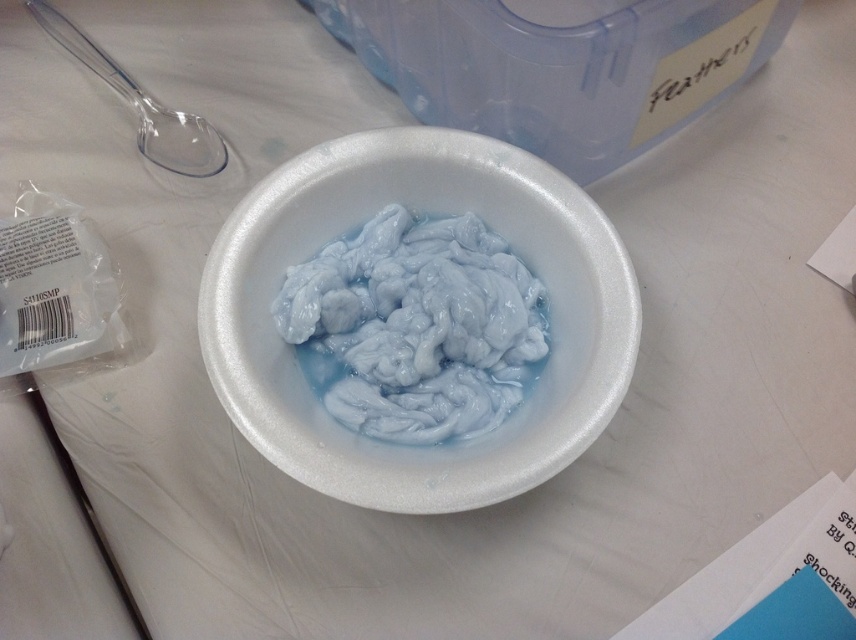
Question: Which object is the closest to the transparent plastic spoon at upper left?

Choices:
 (A) white rubbery substance at center
 (B) white styrofoam bowl at center

Answer: (B)

Question: Is white rubbery substance at center to the left of transparent plastic spoon at upper left from the viewer's perspective?

Choices:
 (A) yes
 (B) no

Answer: (B)

Question: Where is white styrofoam bowl at center located in relation to white rubbery substance at center in the image?

Choices:
 (A) left
 (B) right

Answer: (B)

Question: Does white styrofoam bowl at center have a lesser width compared to transparent plastic spoon at upper left?

Choices:
 (A) no
 (B) yes

Answer: (A)

Question: Which point is farther to the camera?

Choices:
 (A) white styrofoam bowl at center
 (B) white rubbery substance at center

Answer: (B)

Question: Estimate the real-world distances between objects in this image. Which object is farther from the transparent plastic spoon at upper left?

Choices:
 (A) white styrofoam bowl at center
 (B) white rubbery substance at center

Answer: (B)